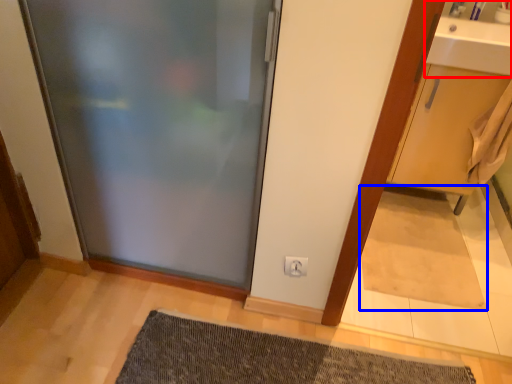
Question: Which object appears farthest to the camera in this image, sink (highlighted by a red box) or doormat (highlighted by a blue box)?

Choices:
 (A) sink
 (B) doormat

Answer: (B)